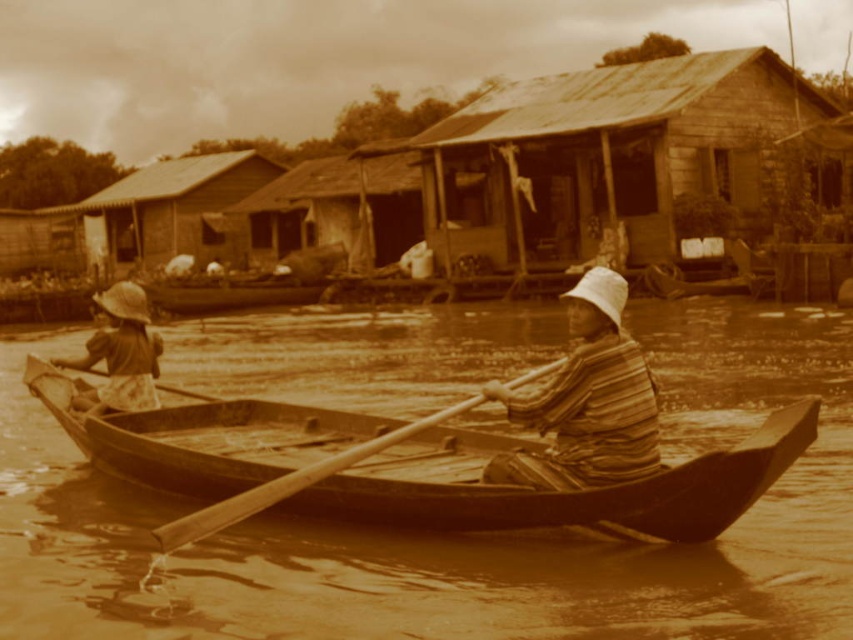
You are planning to set up a small tent for a picnic. You have two options for locations in the image. The first is near the rusty corrugated metal hut at center, and the second is near the wooden at center. Considering the space available, which location would provide more room for your tent?

The rusty corrugated metal hut at center has a larger width than the wooden at center, so the area near the rusty corrugated metal hut at center would provide more space for your tent.

You are standing on the riverside and see the rusty corrugated metal hut at center and the wooden at center. Which one is closer to you?

The rusty corrugated metal hut at center is closer to you because it is further to the viewer than wooden at center.

You are standing on the riverside and see the striped fabric hat at center and the wooden at center in the boat. Which object is positioned more to the right?

The striped fabric hat at center is positioned to the right of wooden at center, so it is more to the right.